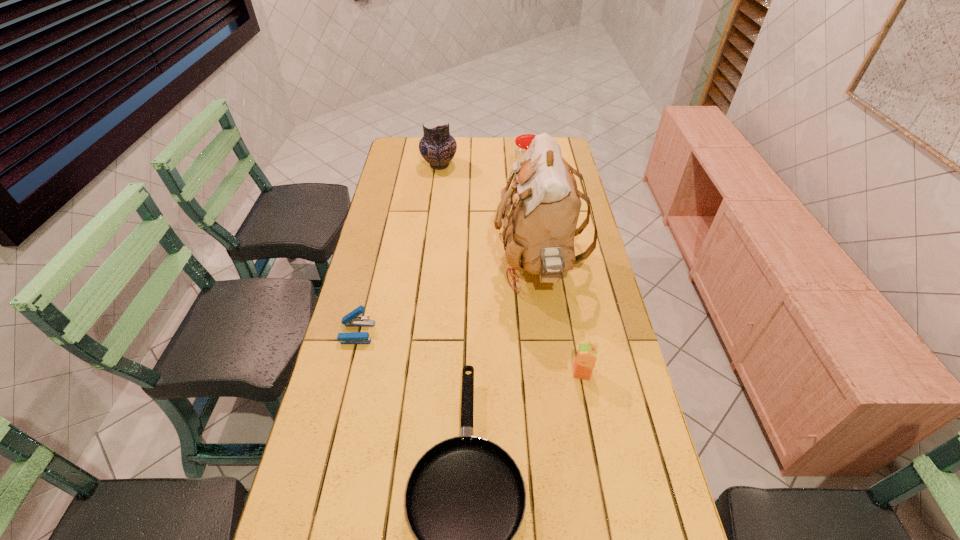
This screenshot has height=540, width=960. What are the coordinates of `object present at the far left corner` in the screenshot? It's located at [437, 146].

This screenshot has height=540, width=960. In order to click on vacant position at the left edge of the desktop in this screenshot , I will do `click(409, 238)`.

Identify the location of vacant space at the right edge of the desktop. (615, 472).

I want to click on free space between the orange juice and the tallest object, so click(x=560, y=319).

Locate an element on the screen. free spot between the pottery and the third nearest object is located at coordinates (398, 249).

Locate an element on the screen. The height and width of the screenshot is (540, 960). vacant region between the pottery and the third farthest object is located at coordinates (489, 216).

You are a GUI agent. You are given a task and a screenshot of the screen. Output one action in this format:
    pyautogui.click(x=<x>, y=<y>)
    Task: Click on the free point between the third nearest object and the fourth tallest object
    
    Given the screenshot: What is the action you would take?
    pyautogui.click(x=469, y=353)

Locate an element on the screen. This screenshot has height=540, width=960. vacant space that is in between the tallest object and the orange juice is located at coordinates 560,319.

Locate an element on the screen. This screenshot has width=960, height=540. empty space between the third tallest object and the leftmost object is located at coordinates (442, 255).

What are the coordinates of `free space between the pottery and the jar` in the screenshot? It's located at (483, 172).